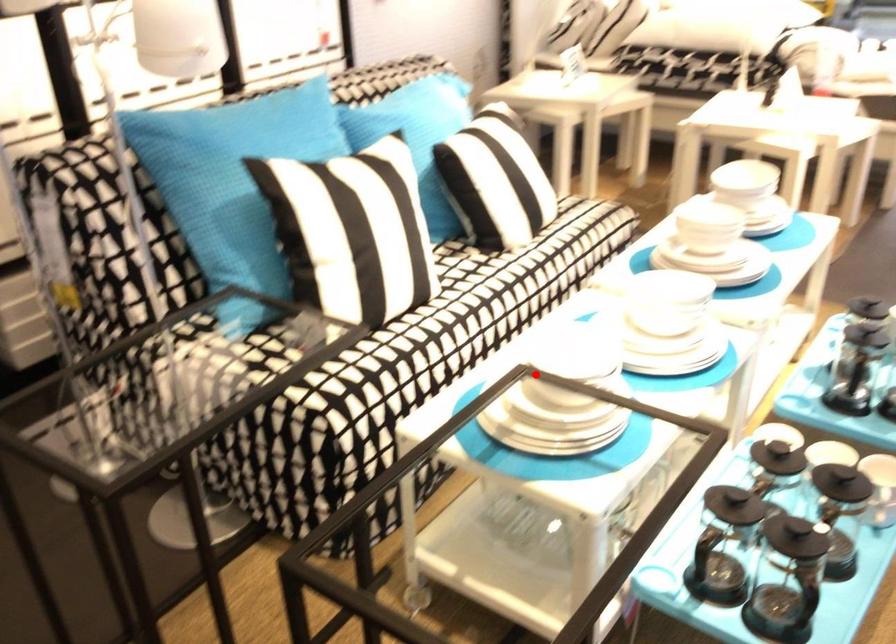
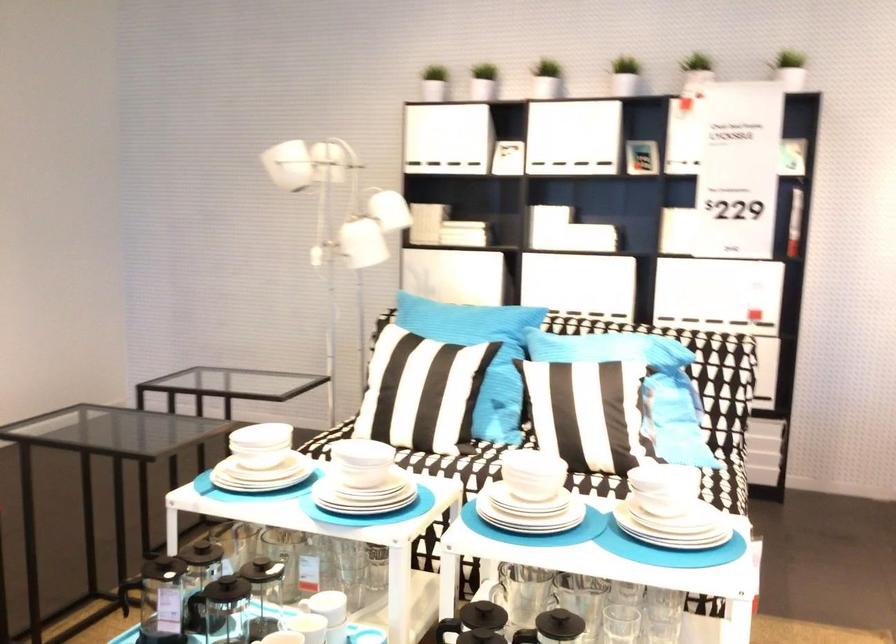
Find the pixel in the second image that matches the highlighted location in the first image.

(261, 440)